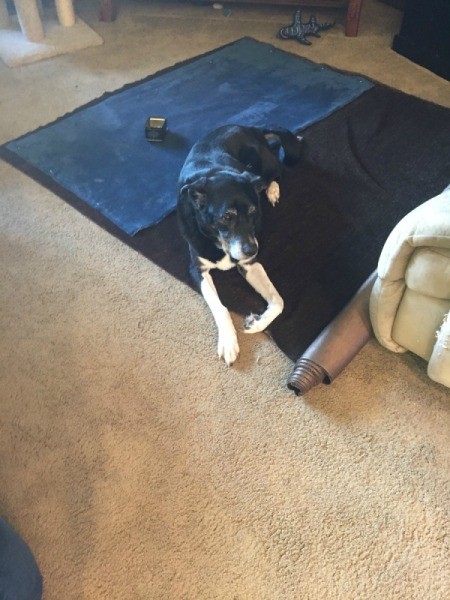
At what (x,y) coordinates should I click in order to perform the action: click on scratchers on cat tree. Please return your answer as a coordinate pair (x, y). Looking at the image, I should click on (4, 18), (27, 19), (66, 10).